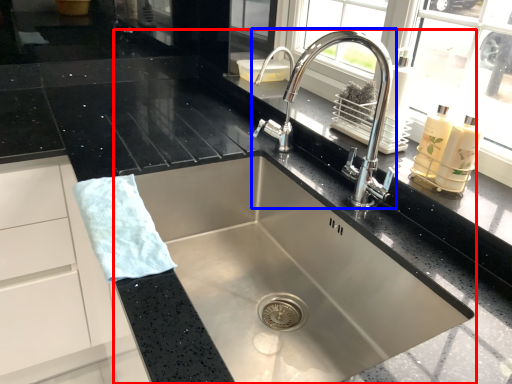
Question: Which point is further to the camera, sink (highlighted by a red box) or tap (highlighted by a blue box)?

Choices:
 (A) sink
 (B) tap

Answer: (B)